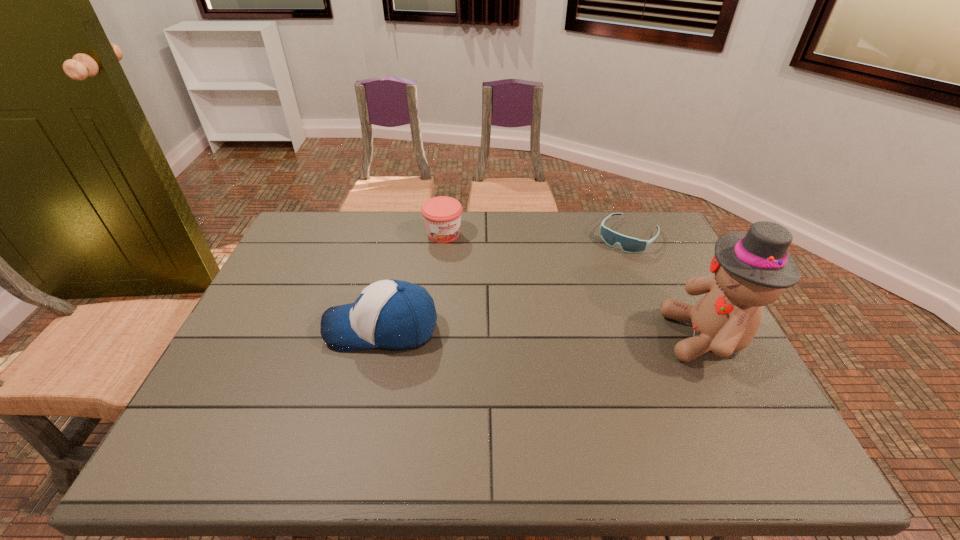
Find the location of `blank area in the image that satisfies the following two spatial constraints: 1. on the front side of the rag_doll; 2. on the front-facing side of the goggles`. blank area in the image that satisfies the following two spatial constraints: 1. on the front side of the rag_doll; 2. on the front-facing side of the goggles is located at coordinates (672, 337).

You are a GUI agent. You are given a task and a screenshot of the screen. Output one action in this format:
    pyautogui.click(x=<x>, y=<y>)
    Task: Click on the vacant area in the image that satisfies the following two spatial constraints: 1. on the front side of the tallest object; 2. on the front-facing side of the third tallest object
    
    Given the screenshot: What is the action you would take?
    pyautogui.click(x=433, y=337)

Where is `vacant area in the image that satisfies the following two spatial constraints: 1. on the front side of the goggles; 2. on the left side of the second shortest object`? vacant area in the image that satisfies the following two spatial constraints: 1. on the front side of the goggles; 2. on the left side of the second shortest object is located at coordinates (444, 236).